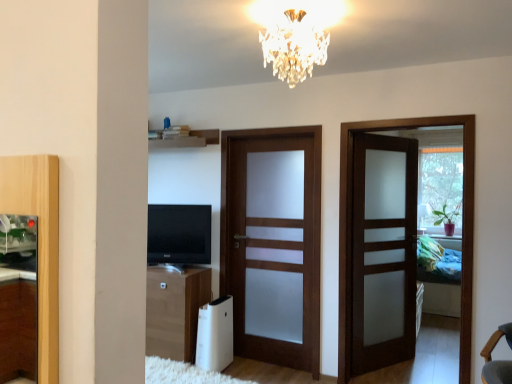
Question: Can you confirm if crystal glass chandelier at upper center is taller than black glossy tv at center?

Choices:
 (A) yes
 (B) no

Answer: (B)

Question: Is crystal glass chandelier at upper center beside black glossy tv at center?

Choices:
 (A) yes
 (B) no

Answer: (B)

Question: From a real-world perspective, is crystal glass chandelier at upper center physically below black glossy tv at center?

Choices:
 (A) yes
 (B) no

Answer: (B)

Question: Does crystal glass chandelier at upper center have a lesser width compared to black glossy tv at center?

Choices:
 (A) yes
 (B) no

Answer: (B)

Question: Is crystal glass chandelier at upper center in front of black glossy tv at center?

Choices:
 (A) no
 (B) yes

Answer: (B)

Question: Can you confirm if crystal glass chandelier at upper center is positioned to the left of black glossy tv at center?

Choices:
 (A) no
 (B) yes

Answer: (A)

Question: Is black glossy tv at center wider than satin wood door at center, which is the 3th door in right-to-left order?

Choices:
 (A) no
 (B) yes

Answer: (A)

Question: Considering the relative sizes of black glossy tv at center and satin wood door at center, which appears as the first door when viewed from the left, in the image provided, is black glossy tv at center shorter than satin wood door at center, which appears as the first door when viewed from the left,?

Choices:
 (A) no
 (B) yes

Answer: (B)

Question: Does black glossy tv at center come behind satin wood door at center, which is the 3th door in right-to-left order?

Choices:
 (A) yes
 (B) no

Answer: (A)

Question: Is black glossy tv at center to the left of satin wood door at center, which appears as the first door when viewed from the left, from the viewer's perspective?

Choices:
 (A) yes
 (B) no

Answer: (A)

Question: From a real-world perspective, is black glossy tv at center on satin wood door at center, which is the 3th door in right-to-left order?

Choices:
 (A) no
 (B) yes

Answer: (B)

Question: Is satin wood door at center, which appears as the first door when viewed from the left, a part of black glossy tv at center?

Choices:
 (A) no
 (B) yes

Answer: (A)

Question: Is wooden shelf at upper center positioned with its back to black glossy tv at center?

Choices:
 (A) yes
 (B) no

Answer: (B)